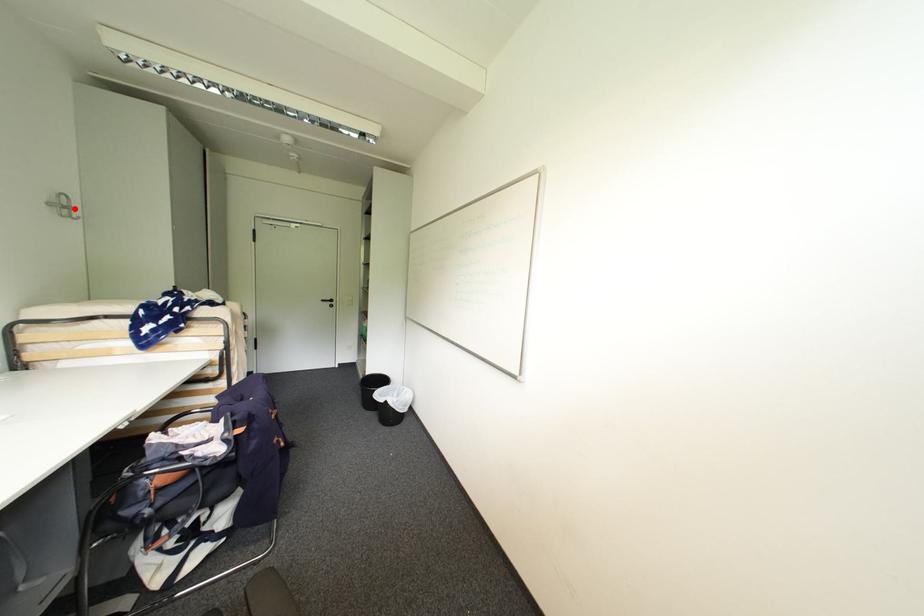
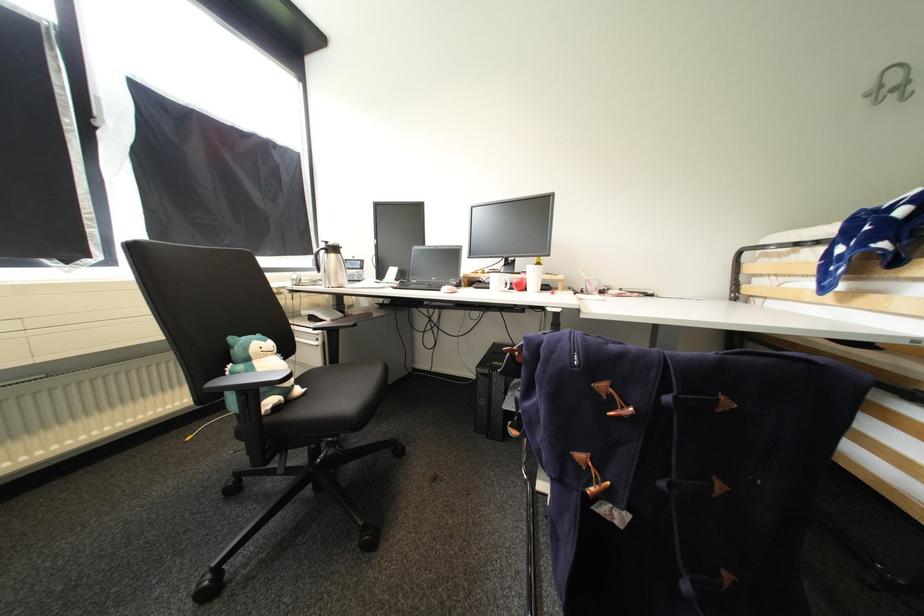
Locate, in the second image, the point that corresponds to the highlighted location in the first image.

(912, 84)